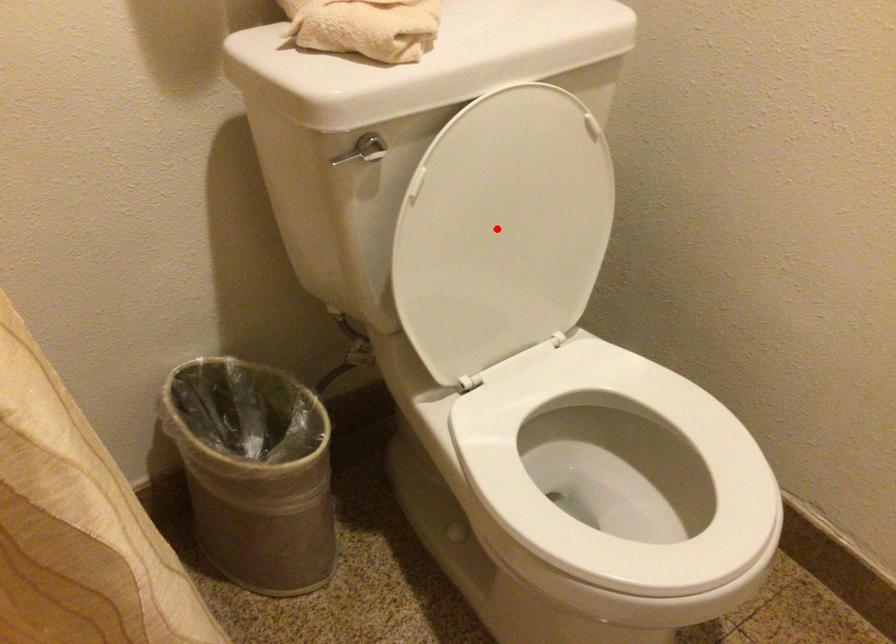
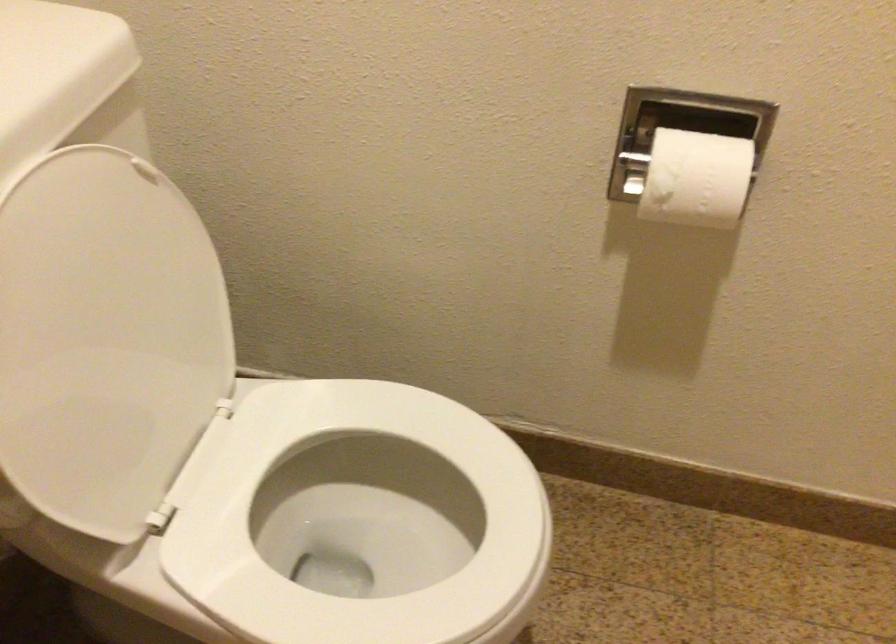
Where in the second image is the point corresponding to the highlighted location from the first image?

(105, 339)